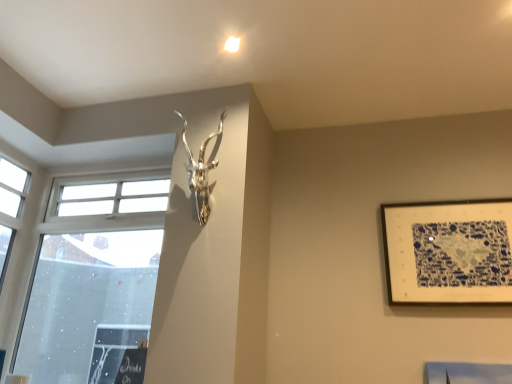
Question: Can we say blue and white paper at upper right lies outside silver metallic antler at upper center?

Choices:
 (A) yes
 (B) no

Answer: (A)

Question: Is blue and white paper at upper right facing towards silver metallic antler at upper center?

Choices:
 (A) yes
 (B) no

Answer: (B)

Question: Is blue and white paper at upper right placed right next to silver metallic antler at upper center?

Choices:
 (A) no
 (B) yes

Answer: (A)

Question: From a real-world perspective, is blue and white paper at upper right beneath silver metallic antler at upper center?

Choices:
 (A) no
 (B) yes

Answer: (B)

Question: From a real-world perspective, is blue and white paper at upper right positioned over silver metallic antler at upper center based on gravity?

Choices:
 (A) no
 (B) yes

Answer: (A)

Question: Does blue and white paper at upper right have a lesser width compared to silver metallic antler at upper center?

Choices:
 (A) no
 (B) yes

Answer: (B)

Question: Is transparent glass window at left behind silver metallic antler at upper center?

Choices:
 (A) no
 (B) yes

Answer: (B)

Question: Does transparent glass window at left come in front of silver metallic antler at upper center?

Choices:
 (A) no
 (B) yes

Answer: (A)

Question: Is transparent glass window at left aimed at silver metallic antler at upper center?

Choices:
 (A) yes
 (B) no

Answer: (B)

Question: Can you confirm if transparent glass window at left is positioned to the left of silver metallic antler at upper center?

Choices:
 (A) no
 (B) yes

Answer: (B)

Question: Can you confirm if transparent glass window at left is positioned to the right of silver metallic antler at upper center?

Choices:
 (A) yes
 (B) no

Answer: (B)

Question: Is transparent glass window at left wider than silver metallic antler at upper center?

Choices:
 (A) yes
 (B) no

Answer: (B)

Question: Could you tell me if transparent glass window at left is facing blue and white paper at upper right?

Choices:
 (A) no
 (B) yes

Answer: (A)